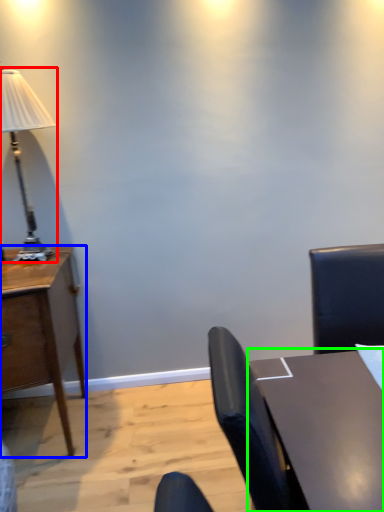
Question: Which object is positioned closest to lamp (highlighted by a red box)? Select from desk (highlighted by a blue box) and table (highlighted by a green box).

Choices:
 (A) desk
 (B) table

Answer: (A)